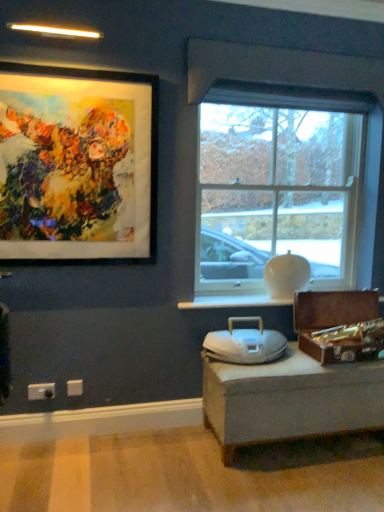
Describe the element at coordinates (245, 343) in the screenshot. I see `white plastic swivel chair at center` at that location.

What do you see at coordinates (278, 182) in the screenshot?
I see `clear glass window at center` at bounding box center [278, 182].

This screenshot has width=384, height=512. Describe the element at coordinates (41, 391) in the screenshot. I see `white plastic electric outlet at lower left, arranged as the 1th electric outlet when viewed from the front` at that location.

Image resolution: width=384 pixels, height=512 pixels. What are the coordinates of `white glossy window sill at center` in the screenshot? It's located at (233, 302).

Is white plastic swivel chair at center turned away from clear glass window at center?

No, white plastic swivel chair at center is not facing away from clear glass window at center.

Is white plastic swivel chair at center far away from clear glass window at center?

No, white plastic swivel chair at center is in close proximity to clear glass window at center.

From the image's perspective, which is above, white plastic swivel chair at center or clear glass window at center?

clear glass window at center, from the image's perspective.

From a real-world perspective, which object rests below the other?

white plastic swivel chair at center is physically lower.

Between white plastic swivel chair at center and white plastic electric outlet at lower left, which is the 2th electric outlet in left-to-right order, which one has smaller width?

white plastic electric outlet at lower left, which is the 2th electric outlet in left-to-right order, is thinner.

From a real-world perspective, is white plastic swivel chair at center below white plastic electric outlet at lower left, the second electric outlet in the front-to-back sequence?

Actually, white plastic swivel chair at center is physically above white plastic electric outlet at lower left, the second electric outlet in the front-to-back sequence, in the real world.

Considering the relative positions of white plastic swivel chair at center and white plastic electric outlet at lower left, the second electric outlet in the front-to-back sequence, in the image provided, is white plastic swivel chair at center to the left of white plastic electric outlet at lower left, the second electric outlet in the front-to-back sequence, from the viewer's perspective?

In fact, white plastic swivel chair at center is to the right of white plastic electric outlet at lower left, the second electric outlet in the front-to-back sequence.

Considering the relative positions of white plastic electric outlet at lower left, which is the 2th electric outlet in left-to-right order, and white glossy window sill at center in the image provided, is white plastic electric outlet at lower left, which is the 2th electric outlet in left-to-right order, to the right of white glossy window sill at center from the viewer's perspective?

No.

Is white plastic electric outlet at lower left, positioned as the first electric outlet in back-to-front order, positioned behind white glossy window sill at center?

No.

From the image's perspective, is white plastic electric outlet at lower left, which is the 2th electric outlet in left-to-right order, located above or below white glossy window sill at center?

white plastic electric outlet at lower left, which is the 2th electric outlet in left-to-right order, is situated lower than white glossy window sill at center in the image.

Is white glossy window sill at center positioned with its back to matte black picture frame at upper left?

white glossy window sill at center is not turned away from matte black picture frame at upper left.

The height and width of the screenshot is (512, 384). I want to click on window sill on the right of the matte black picture frame at upper left, so click(x=233, y=302).

Which of these two, white glossy window sill at center or matte black picture frame at upper left, is smaller?

white glossy window sill at center is smaller.

From a real-world perspective, is white glossy window sill at center on top of matte black picture frame at upper left?

No, from a real-world perspective, white glossy window sill at center is not on top of matte black picture frame at upper left.

Is matte black picture frame at upper left taller or shorter than white glossy window sill at center?

In the image, matte black picture frame at upper left appears to be taller than white glossy window sill at center.

Between point (120, 92) and point (266, 297), which one is positioned in front?

Positioned in front is point (120, 92).

In the image, is matte black picture frame at upper left on the left side or the right side of white glossy window sill at center?

matte black picture frame at upper left is positioned on white glossy window sill at center's left side.

Could white glossy window sill at center be considered to be inside matte black picture frame at upper left?

No, white glossy window sill at center is not surrounded by matte black picture frame at upper left.

Where is `electric outlet above the white plastic electric outlet at lower left, which is the 1th electric outlet in left-to-right order (from the image's perspective)`? electric outlet above the white plastic electric outlet at lower left, which is the 1th electric outlet in left-to-right order (from the image's perspective) is located at coordinates (74, 388).

Considering the sizes of objects white plastic electric outlet at lower left, which ranks as the 2th electric outlet in right-to-left order, and white plastic electric outlet at lower left, positioned as the first electric outlet in back-to-front order, in the image provided, who is smaller, white plastic electric outlet at lower left, which ranks as the 2th electric outlet in right-to-left order, or white plastic electric outlet at lower left, positioned as the first electric outlet in back-to-front order,?

Smaller between the two is white plastic electric outlet at lower left, positioned as the first electric outlet in back-to-front order.

Who is taller, white plastic electric outlet at lower left, arranged as the 1th electric outlet when viewed from the front, or white plastic electric outlet at lower left, positioned as the first electric outlet in back-to-front order?

Standing taller between the two is white plastic electric outlet at lower left, arranged as the 1th electric outlet when viewed from the front.

Is white plastic electric outlet at lower left, arranged as the 1th electric outlet when viewed from the front, to the left or to the right of white plastic electric outlet at lower left, which is the 1th electric outlet from right to left, in the image?

In the image, white plastic electric outlet at lower left, arranged as the 1th electric outlet when viewed from the front, appears on the left side of white plastic electric outlet at lower left, which is the 1th electric outlet from right to left.

Can we say white glossy window sill at center lies outside white plastic swivel chair at center?

Indeed, white glossy window sill at center is completely outside white plastic swivel chair at center.

Does white glossy window sill at center have a larger size compared to white plastic swivel chair at center?

Actually, white glossy window sill at center might be smaller than white plastic swivel chair at center.

Is white glossy window sill at center positioned with its back to white plastic swivel chair at center?

No, white glossy window sill at center is not facing the opposite direction of white plastic swivel chair at center.

This screenshot has width=384, height=512. What are the coordinates of `swivel chair beneath the clear glass window at center (from a real-world perspective)` in the screenshot? It's located at (245, 343).

Starting from the white plastic swivel chair at center, which electric outlet is the 2nd one behind? Please provide its 2D coordinates.

[(74, 388)]

Looking at the image, which one is located closer to white plastic electric outlet at lower left, which is the 1th electric outlet in left-to-right order, white plastic swivel chair at center or white plastic electric outlet at lower left, which is the 1th electric outlet from right to left?

white plastic electric outlet at lower left, which is the 1th electric outlet from right to left, lies closer to white plastic electric outlet at lower left, which is the 1th electric outlet in left-to-right order, than the other object.

When comparing their distances from white plastic swivel chair at center, does white glossy window sill at center or matte black picture frame at upper left seem further?

The object further to white plastic swivel chair at center is matte black picture frame at upper left.

Based on the photo, which object lies nearer to the anchor point white glossy window sill at center, matte black picture frame at upper left or white plastic electric outlet at lower left, arranged as the 1th electric outlet when viewed from the front?

Based on the image, matte black picture frame at upper left appears to be nearer to white glossy window sill at center.

Based on their spatial positions, is white plastic electric outlet at lower left, which is the 1th electric outlet from right to left, or clear glass window at center further from matte black picture frame at upper left?

white plastic electric outlet at lower left, which is the 1th electric outlet from right to left, is further to matte black picture frame at upper left.

Which object lies nearer to the anchor point white plastic electric outlet at lower left, which is the 1th electric outlet from right to left, white glossy window sill at center or clear glass window at center?

white glossy window sill at center is positioned closer to the anchor white plastic electric outlet at lower left, which is the 1th electric outlet from right to left.

Based on their spatial positions, is clear glass window at center or matte black picture frame at upper left closer to white plastic swivel chair at center?

clear glass window at center is positioned closer to the anchor white plastic swivel chair at center.

Based on their spatial positions, is white plastic electric outlet at lower left, the second electric outlet when ordered from back to front, or white plastic electric outlet at lower left, the second electric outlet in the front-to-back sequence, closer to clear glass window at center?

The object closer to clear glass window at center is white plastic electric outlet at lower left, the second electric outlet in the front-to-back sequence.

Considering their positions, is white glossy window sill at center positioned further to white plastic electric outlet at lower left, the second electric outlet when ordered from back to front, than white plastic swivel chair at center?

Based on the image, white plastic swivel chair at center appears to be further to white plastic electric outlet at lower left, the second electric outlet when ordered from back to front.

At what (x,y) coordinates should I click in order to perform the action: click on picture frame between white plastic electric outlet at lower left, which is the 2th electric outlet in left-to-right order, and white glossy window sill at center. Please return your answer as a coordinate pair (x, y). Looking at the image, I should click on (77, 164).

I want to click on swivel chair situated between white plastic electric outlet at lower left, positioned as the first electric outlet in back-to-front order, and white glossy window sill at center from left to right, so click(245, 343).

Image resolution: width=384 pixels, height=512 pixels. Find the location of `swivel chair situated between white plastic electric outlet at lower left, which ranks as the 2th electric outlet in right-to-left order, and white glossy window sill at center from left to right`. swivel chair situated between white plastic electric outlet at lower left, which ranks as the 2th electric outlet in right-to-left order, and white glossy window sill at center from left to right is located at coordinates (245, 343).

Identify the location of window between matte black picture frame at upper left and white glossy window sill at center. The height and width of the screenshot is (512, 384). (278, 182).